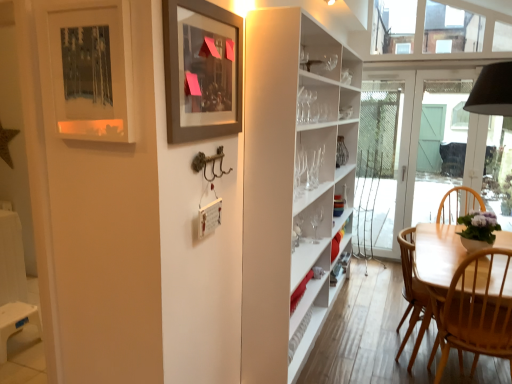
Identify the location of matte gray picture frame at upper center, which is the first picture frame in right-to-left order. This screenshot has width=512, height=384. (202, 70).

This screenshot has height=384, width=512. Describe the element at coordinates (92, 70) in the screenshot. I see `matte black picture frame at upper left, which ranks as the 2th picture frame in right-to-left order` at that location.

Find the location of a particular element. light wood chair at lower right is located at coordinates (437, 254).

From the image's perspective, between matte black picture frame at upper left, which is counted as the first picture frame, starting from the left, and matte gray picture frame at upper center, which is the second picture frame from left to right, which one is located above?

matte gray picture frame at upper center, which is the second picture frame from left to right, is shown above in the image.

In the scene shown: How many degrees apart are the facing directions of matte black picture frame at upper left, which ranks as the 2th picture frame in right-to-left order, and matte gray picture frame at upper center, which is the first picture frame in right-to-left order?

They differ by 91.3 degrees in their facing directions.

Is matte black picture frame at upper left, which ranks as the 2th picture frame in right-to-left order, at the left side of matte gray picture frame at upper center, which is the first picture frame in right-to-left order?

Correct, you'll find matte black picture frame at upper left, which ranks as the 2th picture frame in right-to-left order, to the left of matte gray picture frame at upper center, which is the first picture frame in right-to-left order.

Between light wood chair at lower right and white glass door at center, which one appears on the right side from the viewer's perspective?

Positioned to the right is white glass door at center.

Are light wood chair at lower right and white glass door at center located far from each other?

Yes, light wood chair at lower right and white glass door at center are quite far apart.

Does light wood chair at lower right turn towards white glass door at center?

Yes.

This screenshot has width=512, height=384. I want to click on picture frame lying on the right of matte black picture frame at upper left, which ranks as the 2th picture frame in right-to-left order, so click(x=202, y=70).

Is matte gray picture frame at upper center, which is the second picture frame from left to right, inside or outside of matte black picture frame at upper left, which ranks as the 2th picture frame in right-to-left order?

matte gray picture frame at upper center, which is the second picture frame from left to right, lies outside matte black picture frame at upper left, which ranks as the 2th picture frame in right-to-left order.

Could you tell me if matte gray picture frame at upper center, which is the second picture frame from left to right, is facing matte black picture frame at upper left, which ranks as the 2th picture frame in right-to-left order?

No, matte gray picture frame at upper center, which is the second picture frame from left to right, does not turn towards matte black picture frame at upper left, which ranks as the 2th picture frame in right-to-left order.

Which object is thinner, matte gray picture frame at upper center, which is the second picture frame from left to right, or matte black picture frame at upper left, which is counted as the first picture frame, starting from the left?

matte black picture frame at upper left, which is counted as the first picture frame, starting from the left, is thinner.

Is point (203, 54) closer to viewer compared to point (426, 246)?

Yes, it is.

Can light wood chair at lower right be found inside matte gray picture frame at upper center, which is the second picture frame from left to right?

No, light wood chair at lower right is not surrounded by matte gray picture frame at upper center, which is the second picture frame from left to right.

In the image, is matte gray picture frame at upper center, which is the second picture frame from left to right, on the left side or the right side of light wood chair at lower right?

From the image, it's evident that matte gray picture frame at upper center, which is the second picture frame from left to right, is to the left of light wood chair at lower right.

From the image's perspective, does light wood chair at lower right appear lower than matte black picture frame at upper left, which ranks as the 2th picture frame in right-to-left order?

Indeed, from the image's perspective, light wood chair at lower right is shown beneath matte black picture frame at upper left, which ranks as the 2th picture frame in right-to-left order.

From a real-world perspective, which is physically above, light wood chair at lower right or matte black picture frame at upper left, which is counted as the first picture frame, starting from the left?

matte black picture frame at upper left, which is counted as the first picture frame, starting from the left, is physically above.

Can you confirm if light wood chair at lower right is taller than matte black picture frame at upper left, which ranks as the 2th picture frame in right-to-left order?

Yes, light wood chair at lower right is taller than matte black picture frame at upper left, which ranks as the 2th picture frame in right-to-left order.

Is white glass door at center further to the viewer compared to light wood chair at lower right?

Yes, white glass door at center is further from the camera.

Is white glass door at center oriented towards light wood chair at lower right?

Yes, white glass door at center is aimed at light wood chair at lower right.

Consider the image. Is white glass door at center placed right next to light wood chair at lower right?

No, white glass door at center is not beside light wood chair at lower right.

From the image's perspective, relative to light wood chair at lower right, is white glass door at center above or below?

Based on their image positions, white glass door at center is located above light wood chair at lower right.

Is the position of matte black picture frame at upper left, which ranks as the 2th picture frame in right-to-left order, less distant than that of white glass door at center?

Yes, matte black picture frame at upper left, which ranks as the 2th picture frame in right-to-left order, is closer to the camera.

Can you tell me how much matte black picture frame at upper left, which is counted as the first picture frame, starting from the left, and white glass door at center differ in facing direction?

There is a 1.97-degree angle between the facing directions of matte black picture frame at upper left, which is counted as the first picture frame, starting from the left, and white glass door at center.

Locate an element on the screen. The image size is (512, 384). door that is on the right side of matte black picture frame at upper left, which ranks as the 2th picture frame in right-to-left order is located at coordinates click(x=423, y=145).

Which point is more forward, (106, 66) or (447, 85)?

The point (106, 66) is more forward.

At what (x,y) coordinates should I click in order to perform the action: click on picture frame on the left side of matte gray picture frame at upper center, which is the second picture frame from left to right. Please return your answer as a coordinate pair (x, y). Looking at the image, I should click on (92, 70).

Where is `chair in front of the white glass door at center`? The width and height of the screenshot is (512, 384). chair in front of the white glass door at center is located at coordinates (437, 254).

Looking at the image, which one is located further to matte gray picture frame at upper center, which is the first picture frame in right-to-left order, light wood chair at lower right or matte black picture frame at upper left, which ranks as the 2th picture frame in right-to-left order?

light wood chair at lower right is positioned further to the anchor matte gray picture frame at upper center, which is the first picture frame in right-to-left order.

From the image, which object appears to be farther from light wood chair at lower right, matte black picture frame at upper left, which ranks as the 2th picture frame in right-to-left order, or matte gray picture frame at upper center, which is the second picture frame from left to right?

Based on the image, matte black picture frame at upper left, which ranks as the 2th picture frame in right-to-left order, appears to be further to light wood chair at lower right.

Looking at this image, considering their positions, is light wood chair at lower right positioned closer to matte gray picture frame at upper center, which is the second picture frame from left to right, than white glass door at center?

light wood chair at lower right.

Estimate the real-world distances between objects in this image. Which object is further from matte gray picture frame at upper center, which is the first picture frame in right-to-left order, white glass door at center or matte black picture frame at upper left, which is counted as the first picture frame, starting from the left?

The object further to matte gray picture frame at upper center, which is the first picture frame in right-to-left order, is white glass door at center.

In the scene shown: Considering their positions, is light wood chair at lower right positioned closer to matte black picture frame at upper left, which ranks as the 2th picture frame in right-to-left order, than matte gray picture frame at upper center, which is the second picture frame from left to right?

matte gray picture frame at upper center, which is the second picture frame from left to right.

Looking at the image, which one is located further to white glass door at center, matte black picture frame at upper left, which ranks as the 2th picture frame in right-to-left order, or matte gray picture frame at upper center, which is the first picture frame in right-to-left order?

Based on the image, matte black picture frame at upper left, which ranks as the 2th picture frame in right-to-left order, appears to be further to white glass door at center.

Looking at the image, which one is located closer to white glass door at center, matte black picture frame at upper left, which is counted as the first picture frame, starting from the left, or light wood chair at lower right?

light wood chair at lower right is closer to white glass door at center.

When comparing their distances from white glass door at center, does light wood chair at lower right or matte gray picture frame at upper center, which is the second picture frame from left to right, seem further?

matte gray picture frame at upper center, which is the second picture frame from left to right, is positioned further to the anchor white glass door at center.

Image resolution: width=512 pixels, height=384 pixels. In order to click on chair between matte black picture frame at upper left, which is counted as the first picture frame, starting from the left, and white glass door at center in the front-back direction in this screenshot , I will do `click(437, 254)`.

You are a GUI agent. You are given a task and a screenshot of the screen. Output one action in this format:
    pyautogui.click(x=<x>, y=<y>)
    Task: Click on the picture frame between matte black picture frame at upper left, which ranks as the 2th picture frame in right-to-left order, and white glass door at center in the front-back direction
    
    Given the screenshot: What is the action you would take?
    pyautogui.click(x=202, y=70)

Find the location of `chair between matte gray picture frame at upper center, which is the first picture frame in right-to-left order, and white glass door at center, along the z-axis`. chair between matte gray picture frame at upper center, which is the first picture frame in right-to-left order, and white glass door at center, along the z-axis is located at coordinates (437, 254).

The height and width of the screenshot is (384, 512). Identify the location of picture frame between matte black picture frame at upper left, which is counted as the first picture frame, starting from the left, and light wood chair at lower right, in the horizontal direction. (202, 70).